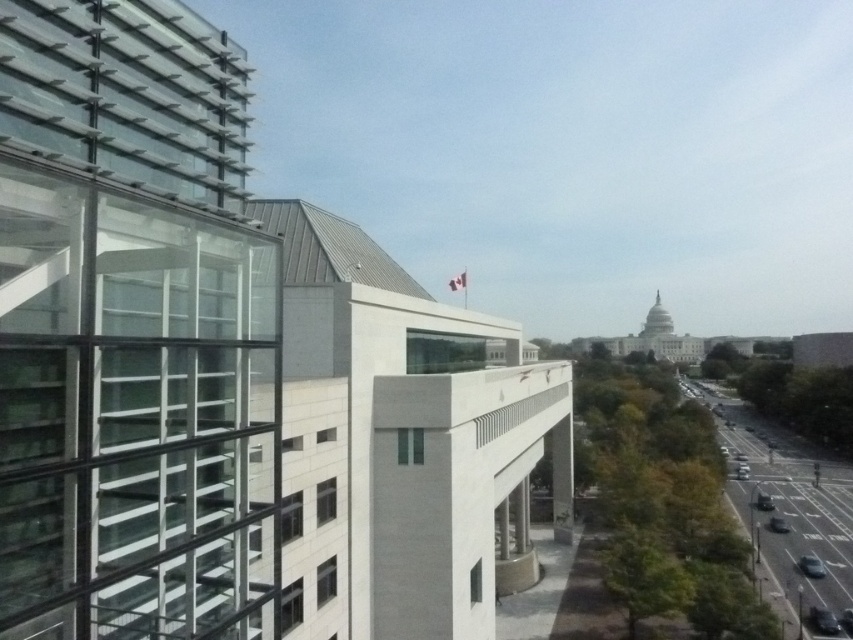
This screenshot has width=853, height=640. What do you see at coordinates (778, 524) in the screenshot? I see `shiny silver car at lower right` at bounding box center [778, 524].

Which is more to the right, shiny silver car at lower right or shiny black car at center?

Positioned to the right is shiny silver car at lower right.

This screenshot has height=640, width=853. I want to click on shiny silver car at lower right, so click(778, 524).

Which is more to the left, silver metallic car at lower right or metallic silver sedan at center-right?

silver metallic car at lower right

From the picture: Which is above, silver metallic car at lower right or metallic silver sedan at center-right?

Positioned higher is silver metallic car at lower right.

At what (x,y) coordinates should I click in order to perform the action: click on silver metallic car at lower right. Please return your answer as a coordinate pair (x, y). Looking at the image, I should click on (811, 566).

From the picture: Who is shorter, silver metallic sedan at center-right or metallic silver sedan at center-right?

silver metallic sedan at center-right is shorter.

The height and width of the screenshot is (640, 853). What are the coordinates of `silver metallic sedan at center-right` in the screenshot? It's located at (741, 472).